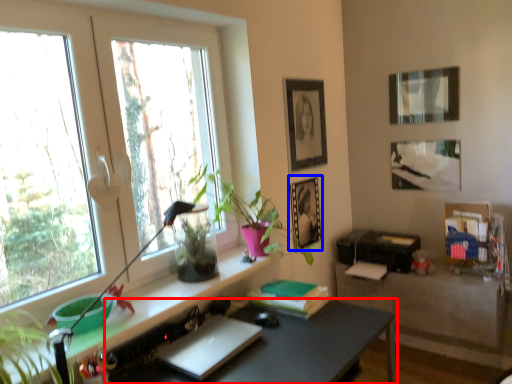
Question: Which point is closer to the camera, desk (highlighted by a red box) or picture frame (highlighted by a blue box)?

Choices:
 (A) desk
 (B) picture frame

Answer: (A)